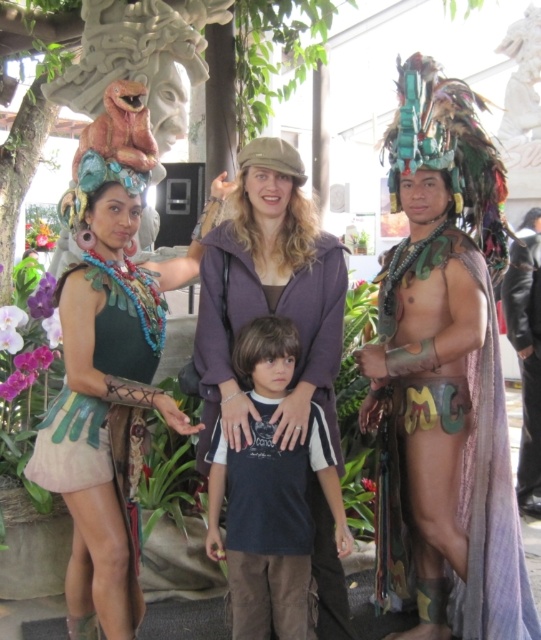
Question: Where is matte green dress at center located in relation to matte green fabric dress at left in the image?

Choices:
 (A) left
 (B) right

Answer: (B)

Question: Is multicolored feather headdress at center to the right of matte green dress at center from the viewer's perspective?

Choices:
 (A) no
 (B) yes

Answer: (B)

Question: Is dark blue t-shirt at center in front of matte green fabric dress at left?

Choices:
 (A) yes
 (B) no

Answer: (B)

Question: Among these objects, which one is farthest from the camera?

Choices:
 (A) matte green fabric dress at left
 (B) black leather jacket at right
 (C) dark blue t-shirt at center
 (D) matte green dress at center

Answer: (B)

Question: Which object is closer to the camera taking this photo?

Choices:
 (A) black leather jacket at right
 (B) matte green dress at center

Answer: (B)

Question: Among these objects, which one is nearest to the camera?

Choices:
 (A) multicolored feather headdress at center
 (B) dark blue t-shirt at center
 (C) matte green dress at center

Answer: (C)